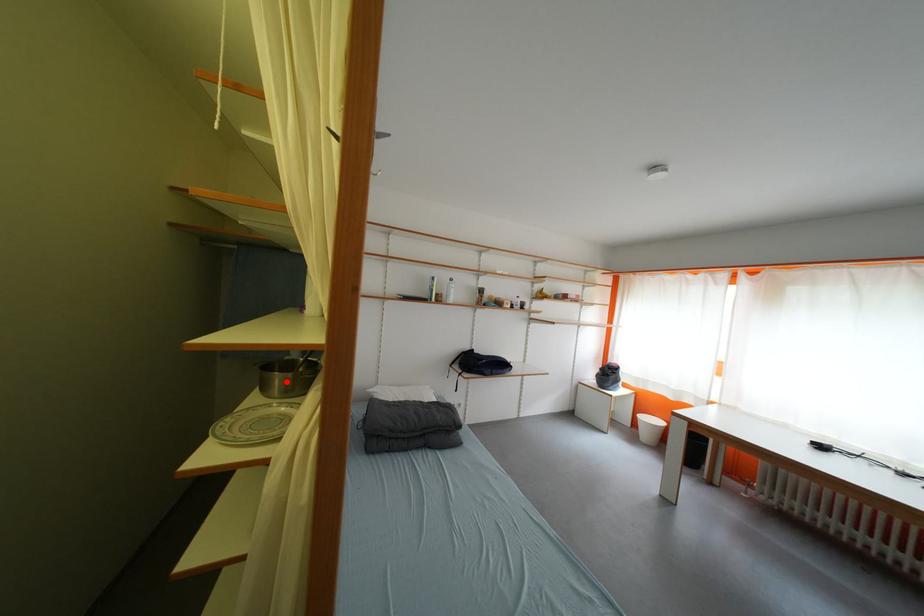
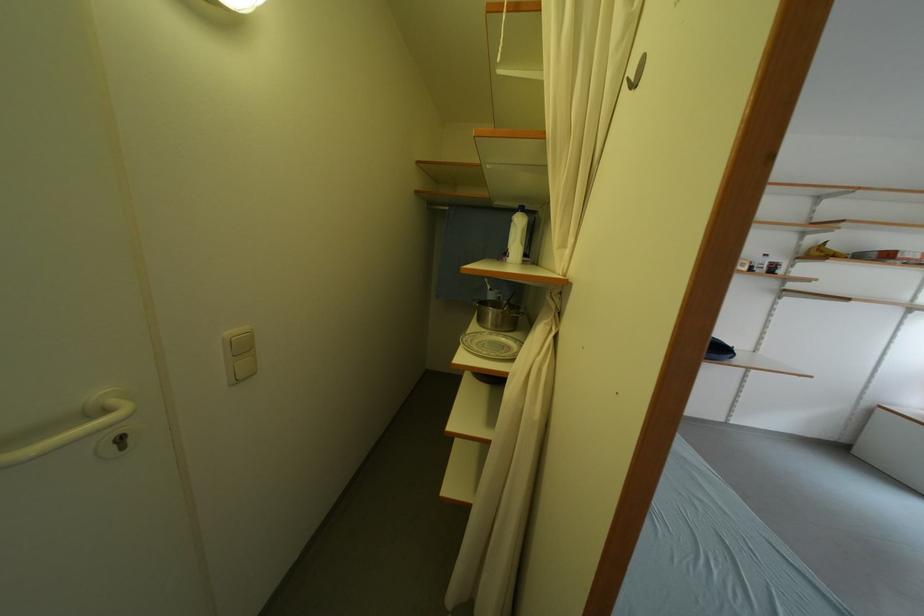
Find the pixel in the second image that matches the highlighted location in the first image.

(500, 317)